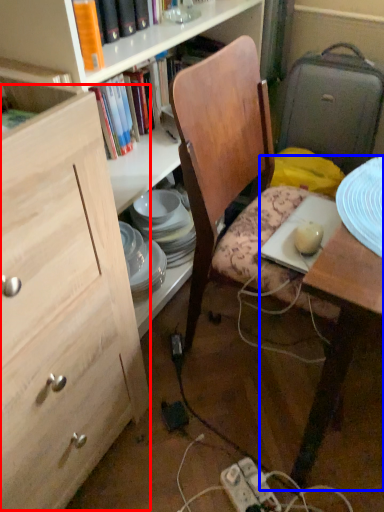
Question: Which object is further to the camera taking this photo, cabinetry (highlighted by a red box) or desk (highlighted by a blue box)?

Choices:
 (A) cabinetry
 (B) desk

Answer: (B)